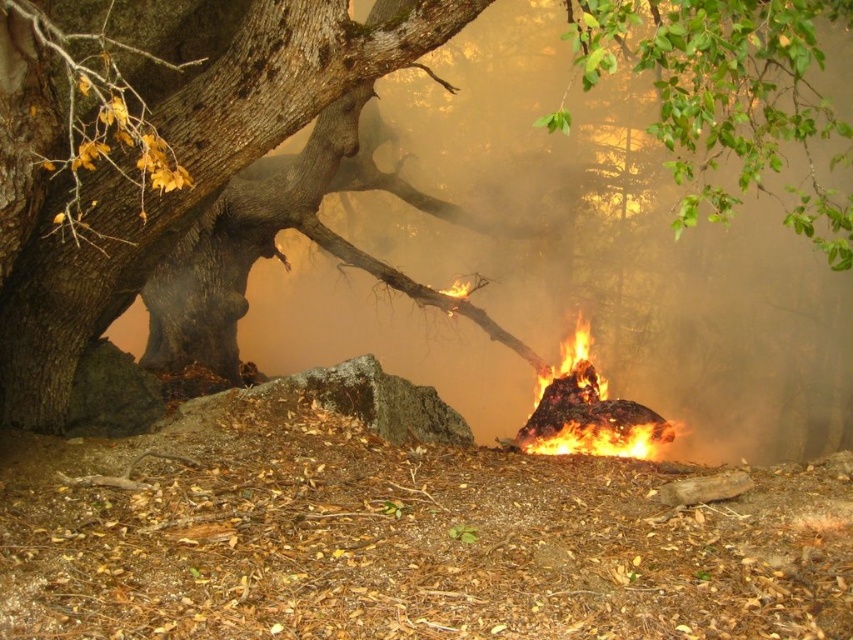
You are standing in the forest and want to put out the fire near the rough bark tree at center. If you have a fire extinguisher that can spray up to 3 meters, will you be able to reach the fire from your current position?

The rough bark tree at center and viewer are 3.08 meters apart from each other. Since the fire extinguisher can spray up to 3 meters, you are slightly out of range and cannot reach the fire from your current position.

You are a firefighter assessing the situation. You need to determine the direction the fire might spread next based on the positions of the rough bark tree at center and the flaming debris at center. Which direction should you prioritize for containment?

The rough bark tree at center is to the left of the flaming debris at center, so the fire is likely spreading towards the right. You should prioritize containment to the right side of the flaming debris at center to prevent further spread.

You are a firefighter assessing the fire scene. You notice two critical points marked as point 1 and point 2. Point 1 is at coordinates point (676, 129) and point 2 is at coordinates point (578, 378). Which point is closer to you as you stand at the scene?

Point 1 is closer to the viewer than point 2.